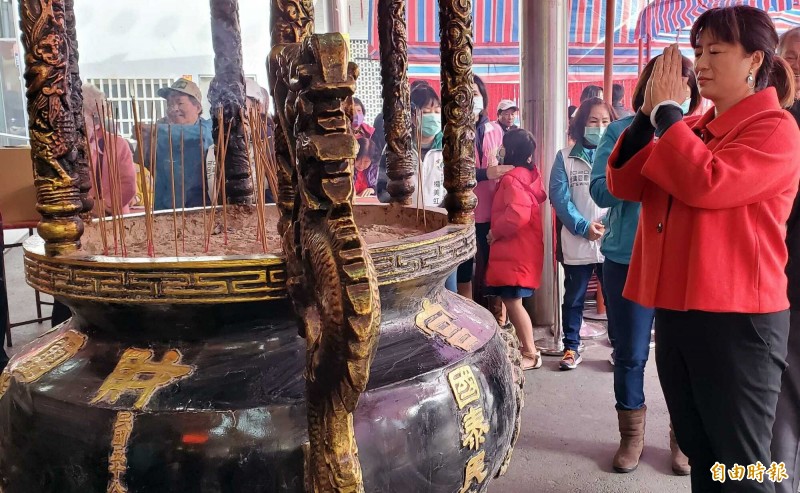
Identify the location of coat. (685, 245), (520, 243), (622, 247), (188, 152), (126, 171), (361, 138), (370, 168), (426, 182).